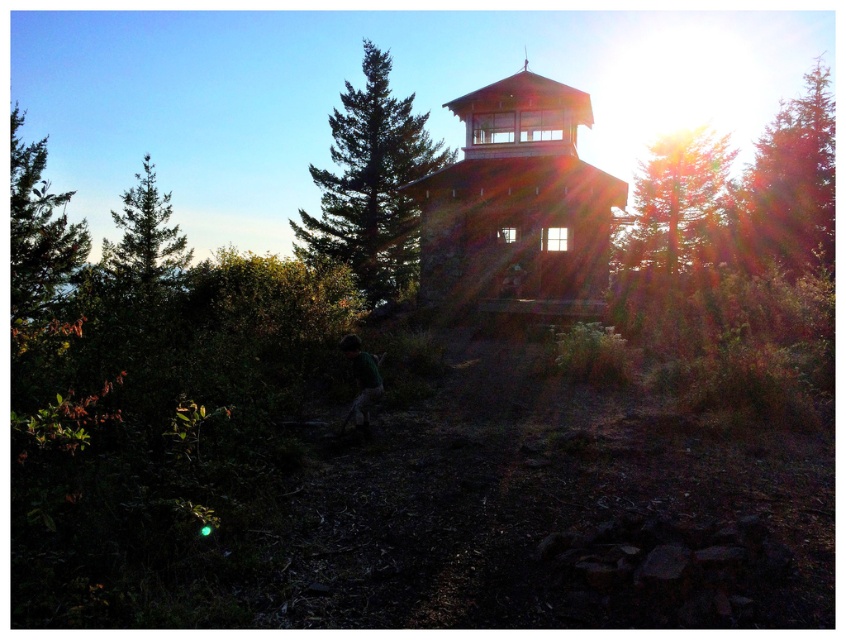
Who is lower down, brown wooden tower at center or green textured pine tree at center?

brown wooden tower at center is lower down.

Is brown wooden tower at center taller than green textured pine tree at center?

In fact, brown wooden tower at center may be shorter than green textured pine tree at center.

Describe the element at coordinates (517, 205) in the screenshot. I see `brown wooden tower at center` at that location.

You are a GUI agent. You are given a task and a screenshot of the screen. Output one action in this format:
    pyautogui.click(x=<x>, y=<y>)
    Task: Click on the brown wooden tower at center
    This screenshot has height=640, width=846.
    Given the screenshot: What is the action you would take?
    pyautogui.click(x=517, y=205)

Is the position of brown wooden tower at center more distant than that of green leafy tree at left?

That is True.

What do you see at coordinates (517, 205) in the screenshot? I see `brown wooden tower at center` at bounding box center [517, 205].

Image resolution: width=846 pixels, height=640 pixels. Find the location of `brown wooden tower at center`. brown wooden tower at center is located at coordinates (517, 205).

Does brown wooden tower at center appear over green needle-like tree at left?

Incorrect, brown wooden tower at center is not positioned above green needle-like tree at left.

Which is more to the right, brown wooden tower at center or green needle-like tree at left?

brown wooden tower at center is more to the right.

Does point (528, 214) lie in front of point (127, 225)?

Yes, point (528, 214) is closer to viewer.

This screenshot has width=846, height=640. I want to click on brown wooden tower at center, so click(x=517, y=205).